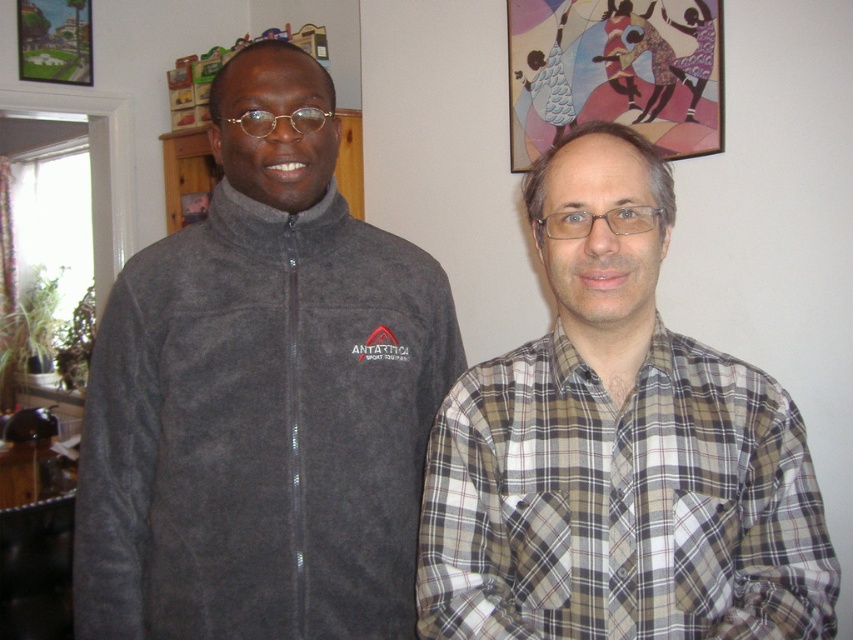
Question: Does dark gray fleece jacket at left appear over plaid fabric shirt at right?

Choices:
 (A) yes
 (B) no

Answer: (A)

Question: Does dark gray fleece jacket at left appear on the left side of plaid fabric shirt at right?

Choices:
 (A) no
 (B) yes

Answer: (B)

Question: Can you confirm if dark gray fleece jacket at left is wider than plaid fabric shirt at right?

Choices:
 (A) no
 (B) yes

Answer: (B)